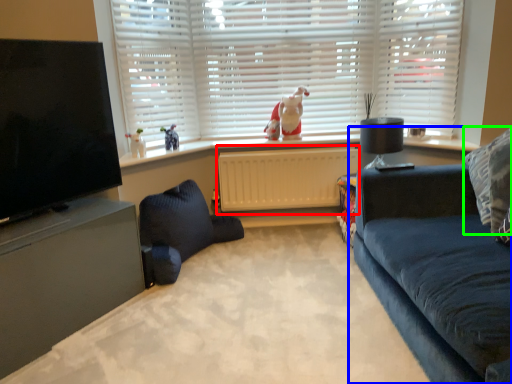
Question: Estimate the real-world distances between objects in this image. Which object is farther from radiator (highlighted by a red box), studio couch (highlighted by a blue box) or pillow (highlighted by a green box)?

Choices:
 (A) studio couch
 (B) pillow

Answer: (B)